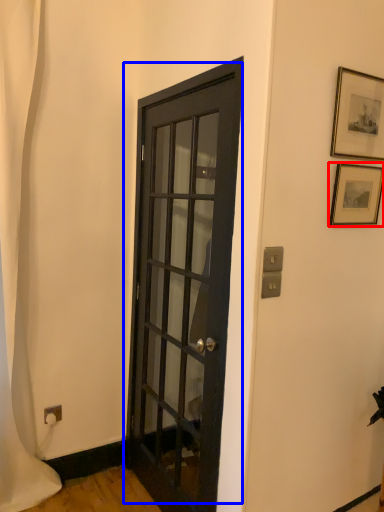
Question: Among these objects, which one is farthest to the camera, picture frame (highlighted by a red box) or door (highlighted by a blue box)?

Choices:
 (A) picture frame
 (B) door

Answer: (A)